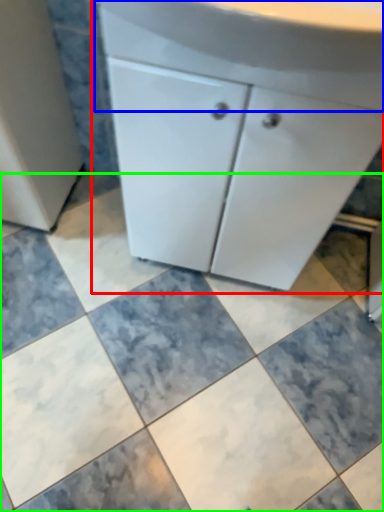
Question: Which is nearer to the bathroom cabinet (highlighted by a red box)? counter top (highlighted by a blue box) or ceramic tile (highlighted by a green box).

Choices:
 (A) counter top
 (B) ceramic tile

Answer: (A)